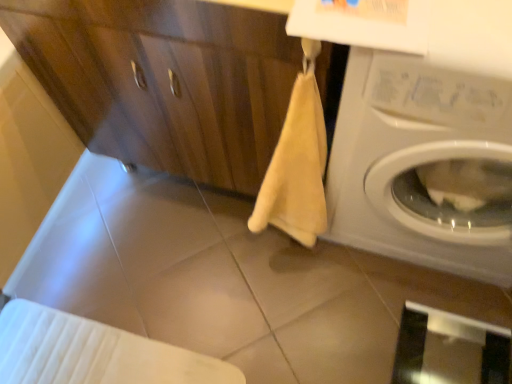
You are a GUI agent. You are given a task and a screenshot of the screen. Output one action in this format:
    pyautogui.click(x=<x>, y=<y>)
    Task: Click on the vacant space to the left of beige matte tile at center
    
    Given the screenshot: What is the action you would take?
    pyautogui.click(x=138, y=289)